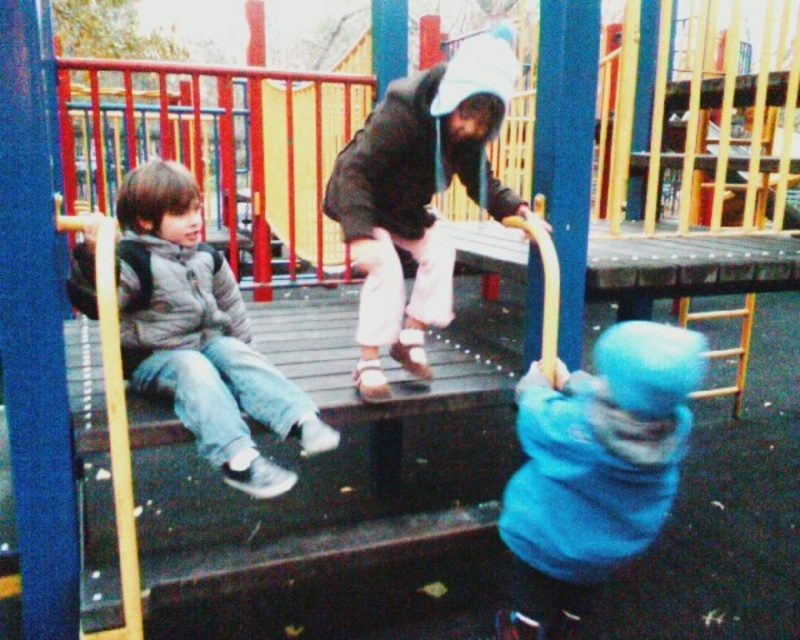
Question: Is blue fuzzy hat at lower right below gray fuzzy jacket at left?

Choices:
 (A) no
 (B) yes

Answer: (B)

Question: Among these points, which one is farthest from the camera?

Choices:
 (A) (606, 500)
 (B) (281, 472)

Answer: (B)

Question: Among these points, which one is nearest to the camera?

Choices:
 (A) (184, 250)
 (B) (600, 448)

Answer: (B)

Question: Is blue fuzzy hat at lower right in front of gray fuzzy jacket at left?

Choices:
 (A) no
 (B) yes

Answer: (B)

Question: Can you confirm if blue fuzzy hat at lower right is smaller than gray fuzzy jacket at left?

Choices:
 (A) no
 (B) yes

Answer: (B)